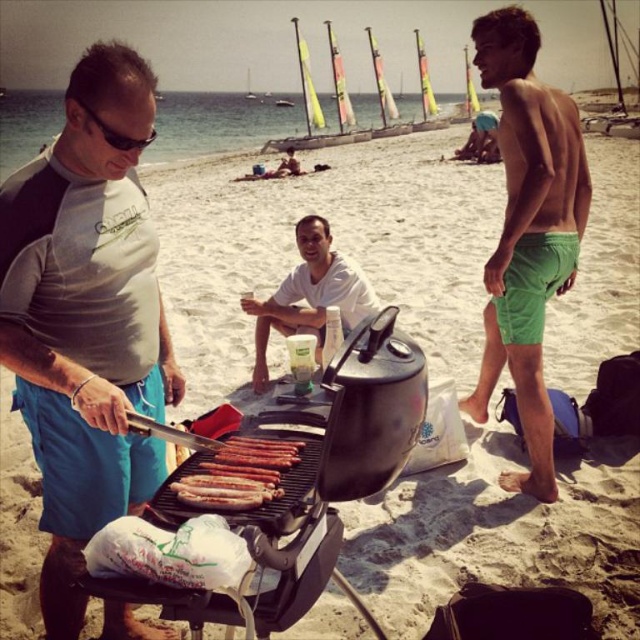
From the picture: You are a photographer taking a picture of the barbecue scene. You notice the white matte shirt at center and the brown glossy sausages at center. Which object should you focus on if you want to capture the one closer to the camera?

The white matte shirt at center is above the brown glossy sausages at center, meaning it is closer to the camera. Therefore, you should focus on the white matte shirt at center to capture the closer object.

Based on the photo, you are a photographer trying to capture a closeup of the grill while ensuring the green cotton shorts at right are visible in the frame. Given that the grill is at the center and the green cotton shorts at right are located at point (528, 230), can you determine if the shorts will be in the shot?

The point (528, 230) marks the location of the green cotton shorts at right. Since the grill is at the center and the shorts are positioned to the right, they should be within the frame if the camera is focused on the grill and the shot includes the right side of the scene.

You are a photographer standing at the edge of the beach, wanting to take a photo that includes both the white matte shirt at center and the brown glossy sausages at center. Given that your camera has a maximum focus range of 3 meters, will you be able to capture both subjects in focus without moving closer?

The distance between the white matte shirt at center and brown glossy sausages at center is 3.13 meters, which exceeds the camera maximum focus range of 3 meters. Therefore, you cannot capture both subjects in focus without moving closer.